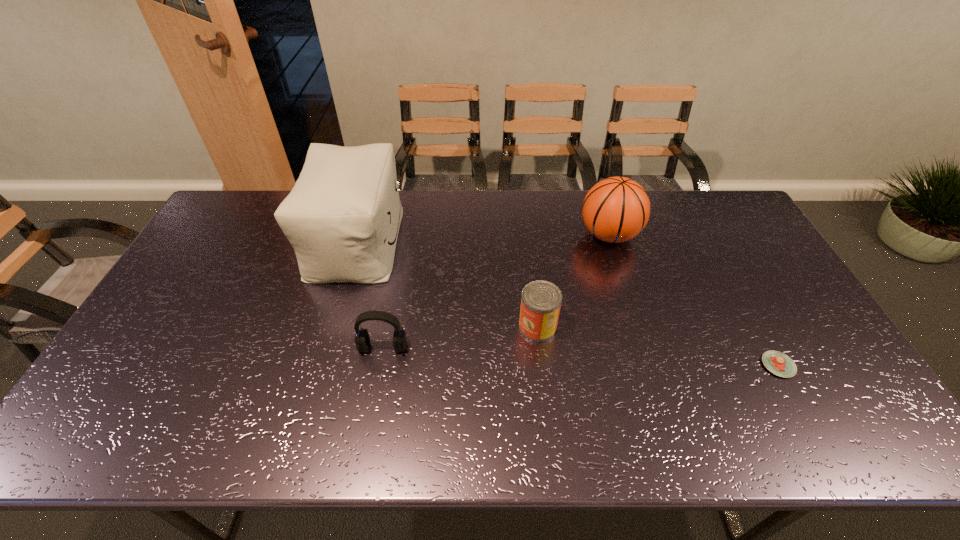
Locate which object is the closest to the headset. Please provide its 2D coordinates. Your answer should be formatted as a tuple, i.e. [(x, y)], where the tuple contains the x and y coordinates of a point satisfying the conditions above.

[(342, 217)]

Image resolution: width=960 pixels, height=540 pixels. In order to click on object that is the closest to the headset in this screenshot , I will do `click(342, 217)`.

Identify the location of vacant space that satisfies the following two spatial constraints: 1. on the headband of the shortest object; 2. on the right side of the headset. (379, 365).

The image size is (960, 540). I want to click on free spot that satisfies the following two spatial constraints: 1. on the back side of the can; 2. on the side of the tallest object with the smiley face, so click(x=528, y=242).

This screenshot has height=540, width=960. I want to click on vacant space that satisfies the following two spatial constraints: 1. on the headband of the headset; 2. on the right side of the pastry, so click(x=379, y=365).

Find the location of a particular element. This screenshot has height=540, width=960. free point that satisfies the following two spatial constraints: 1. on the front side of the second tallest object; 2. on the side of the tallest object with the smiley face is located at coordinates (612, 242).

Where is `blank area in the image that satisfies the following two spatial constraints: 1. on the side of the tallest object with the smiley face; 2. on the right side of the can`? blank area in the image that satisfies the following two spatial constraints: 1. on the side of the tallest object with the smiley face; 2. on the right side of the can is located at coordinates (332, 327).